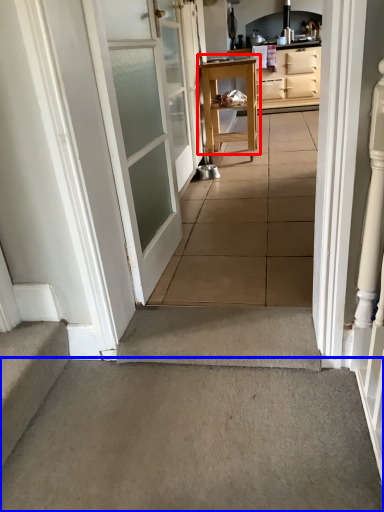
Question: Which object is further to the camera taking this photo, table (highlighted by a red box) or concrete (highlighted by a blue box)?

Choices:
 (A) table
 (B) concrete

Answer: (A)